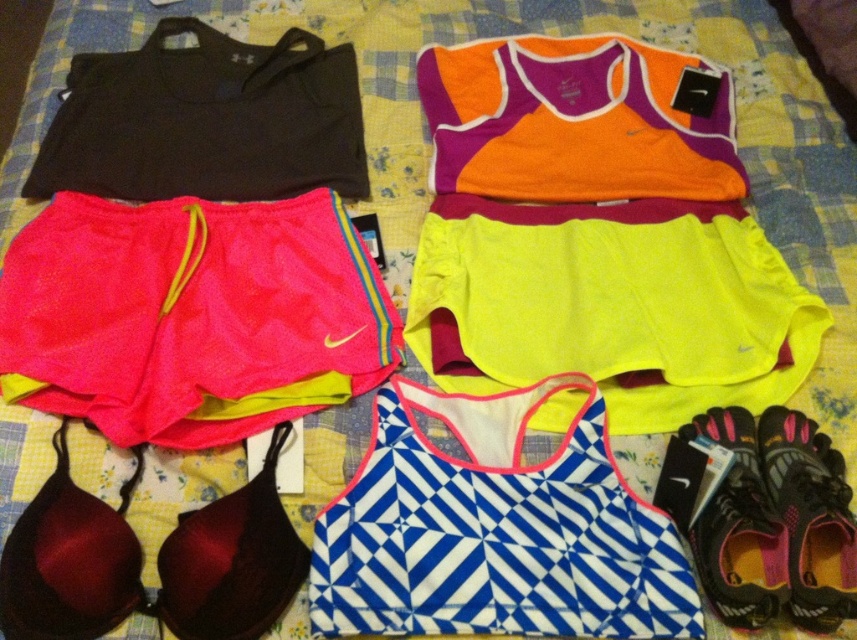
Which is in front, point (315, 340) or point (768, 499)?

Point (768, 499) is in front.

Is pink mesh shorts at lower left to the right of pink mesh shoe at lower right from the viewer's perspective?

No, pink mesh shorts at lower left is not to the right of pink mesh shoe at lower right.

Locate an element on the screen. This screenshot has width=857, height=640. pink mesh shorts at lower left is located at coordinates (190, 316).

Where is `pink mesh shorts at lower left`? The width and height of the screenshot is (857, 640). pink mesh shorts at lower left is located at coordinates (190, 316).

Is point (526, 506) more distant than point (810, 456)?

That is False.

Is blue and white geometric sports bra at center above black mesh shoe at lower right?

Indeed, blue and white geometric sports bra at center is positioned over black mesh shoe at lower right.

Between point (518, 624) and point (814, 484), which one is positioned in front?

Point (518, 624)

Where is `blue and white geometric sports bra at center`? This screenshot has height=640, width=857. blue and white geometric sports bra at center is located at coordinates (495, 529).

Can you confirm if blue and white geometric sports bra at center is wider than black fabric shorts at upper left?

In fact, blue and white geometric sports bra at center might be narrower than black fabric shorts at upper left.

At what (x,y) coordinates should I click in order to perform the action: click on blue and white geometric sports bra at center. Please return your answer as a coordinate pair (x, y). The width and height of the screenshot is (857, 640). Looking at the image, I should click on (495, 529).

The image size is (857, 640). In order to click on blue and white geometric sports bra at center in this screenshot , I will do `click(495, 529)`.